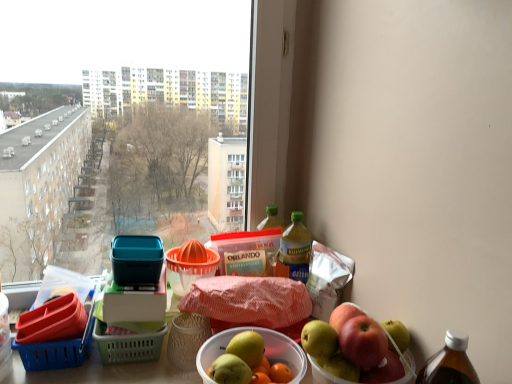
Measure the distance between orange plastic juicer at center, which is counted as the 2th basket, starting from the left, and camera.

The distance of orange plastic juicer at center, which is counted as the 2th basket, starting from the left, from camera is 3.28 feet.

Locate an element on the screen. The height and width of the screenshot is (384, 512). blue plastic basket at lower left, the 1th basket when ordered from left to right is located at coordinates (55, 352).

Which of these two, shiny red apple at right or yellow translucent bottle at upper right, arranged as the first bottle when viewed from the right, is wider?

With larger width is shiny red apple at right.

Which is further, (x=411, y=377) or (x=297, y=260)?

Positioned behind is point (x=297, y=260).

From the image's perspective, between shiny red apple at right and yellow translucent bottle at upper right, arranged as the first bottle when viewed from the right, which one is located above?

yellow translucent bottle at upper right, arranged as the first bottle when viewed from the right.

Can you tell me how much orange plastic juicer at center, the 1th basket viewed from the top, and translucent plastic bottle at upper right, marked as the first bottle in a left-to-right arrangement, differ in facing direction?

The facing directions of orange plastic juicer at center, the 1th basket viewed from the top, and translucent plastic bottle at upper right, marked as the first bottle in a left-to-right arrangement, are 0.00125 degrees apart.

From the image's perspective, who appears lower, orange plastic juicer at center, which is counted as the 2th basket, starting from the left, or translucent plastic bottle at upper right, which ranks as the second bottle in right-to-left order?

orange plastic juicer at center, which is counted as the 2th basket, starting from the left, is shown below in the image.

Is point (180, 288) more distant than point (265, 221)?

No, (180, 288) is in front of (265, 221).

Between orange plastic juicer at center, the 1th basket viewed from the top, and translucent plastic bottle at upper right, which ranks as the second bottle in right-to-left order, which one is positioned behind?

translucent plastic bottle at upper right, which ranks as the second bottle in right-to-left order, is further away from the camera.

Considering the sizes of objects shiny red apple at right and translucent plastic bottle at upper right, which ranks as the second bottle in right-to-left order, in the image provided, who is shorter, shiny red apple at right or translucent plastic bottle at upper right, which ranks as the second bottle in right-to-left order,?

translucent plastic bottle at upper right, which ranks as the second bottle in right-to-left order.

From a real-world perspective, is shiny red apple at right physically located above or below translucent plastic bottle at upper right, marked as the first bottle in a left-to-right arrangement?

Clearly, from a real-world perspective, shiny red apple at right is below translucent plastic bottle at upper right, marked as the first bottle in a left-to-right arrangement.

In terms of width, does shiny red apple at right look wider or thinner when compared to translucent plastic bottle at upper right, which ranks as the second bottle in right-to-left order?

Considering their sizes, shiny red apple at right looks broader than translucent plastic bottle at upper right, which ranks as the second bottle in right-to-left order.

Could you measure the distance between shiny red apple at right and translucent plastic bottle at upper right, which ranks as the second bottle in right-to-left order?

The distance of shiny red apple at right from translucent plastic bottle at upper right, which ranks as the second bottle in right-to-left order, is 17.24 inches.

Measure the distance from orange plastic juicer at center, which is the second basket from bottom to top, to blue plastic basket at lower left, the second basket from the right.

orange plastic juicer at center, which is the second basket from bottom to top, is 9.84 inches away from blue plastic basket at lower left, the second basket from the right.

Which is in front, orange plastic juicer at center, the 1th basket viewed from the top, or blue plastic basket at lower left, the second basket when ordered from top to bottom?

blue plastic basket at lower left, the second basket when ordered from top to bottom, is in front.

Which object is wider, orange plastic juicer at center, the 1th basket viewed from the top, or blue plastic basket at lower left, the second basket when ordered from top to bottom?

blue plastic basket at lower left, the second basket when ordered from top to bottom.

Is point (196, 269) positioned in front of point (36, 353)?

That is False.

Is point (84, 355) positioned in front of point (207, 264)?

Yes.

Is blue plastic basket at lower left, the second basket when ordered from top to bottom, oriented away from orange plastic juicer at center, which ranks as the first basket in right-to-left order?

No, blue plastic basket at lower left, the second basket when ordered from top to bottom, is not facing the opposite direction of orange plastic juicer at center, which ranks as the first basket in right-to-left order.

Based on the photo, would you say blue plastic basket at lower left, the 1th basket when ordered from left to right, is inside or outside orange plastic juicer at center, which is the second basket from bottom to top?

blue plastic basket at lower left, the 1th basket when ordered from left to right, is outside orange plastic juicer at center, which is the second basket from bottom to top.

Is shiny red apple at right facing towards blue plastic basket at lower left, the second basket from the right?

No, shiny red apple at right is not facing towards blue plastic basket at lower left, the second basket from the right.

Which object is further away from the camera taking this photo, shiny red apple at right or blue plastic basket at lower left, the second basket when ordered from top to bottom?

blue plastic basket at lower left, the second basket when ordered from top to bottom, is further away from the camera.

Does shiny red apple at right have a greater height compared to blue plastic basket at lower left, the second basket when ordered from top to bottom?

Yes, shiny red apple at right is taller than blue plastic basket at lower left, the second basket when ordered from top to bottom.

Is shiny red apple at right wider than blue plastic basket at lower left, the second basket from the right?

Incorrect, the width of shiny red apple at right does not surpass that of blue plastic basket at lower left, the second basket from the right.

Between translucent plastic bottle at upper right, which ranks as the second bottle in right-to-left order, and yellow translucent bottle at upper right, the 2th bottle from the left, which one has less height?

With less height is yellow translucent bottle at upper right, the 2th bottle from the left.

Considering the sizes of objects translucent plastic bottle at upper right, marked as the first bottle in a left-to-right arrangement, and yellow translucent bottle at upper right, the 2th bottle from the left, in the image provided, who is wider, translucent plastic bottle at upper right, marked as the first bottle in a left-to-right arrangement, or yellow translucent bottle at upper right, the 2th bottle from the left,?

Wider between the two is yellow translucent bottle at upper right, the 2th bottle from the left.

From the image's perspective, is translucent plastic bottle at upper right, marked as the first bottle in a left-to-right arrangement, located beneath yellow translucent bottle at upper right, arranged as the first bottle when viewed from the right?

No.

How far apart are translucent plastic bottle at upper right, marked as the first bottle in a left-to-right arrangement, and yellow translucent bottle at upper right, arranged as the first bottle when viewed from the right?

translucent plastic bottle at upper right, marked as the first bottle in a left-to-right arrangement, is 3.53 inches away from yellow translucent bottle at upper right, arranged as the first bottle when viewed from the right.

Where is `the 1st bottle behind the shiny red apple at right, starting your count from the anchor`? the 1st bottle behind the shiny red apple at right, starting your count from the anchor is located at coordinates (295, 250).

From a real-world perspective, which bottle is the 2nd one above the orange plastic juicer at center, the 1th basket viewed from the top? Please provide its 2D coordinates.

[(271, 219)]

Based on their spatial positions, is orange plastic juicer at center, the 1th basket viewed from the top, or translucent plastic bottle at upper right, which ranks as the second bottle in right-to-left order, closer to shiny red apple at right?

orange plastic juicer at center, the 1th basket viewed from the top, is closer to shiny red apple at right.

Which object lies nearer to the anchor point yellow translucent bottle at upper right, arranged as the first bottle when viewed from the right, orange plastic juicer at center, which ranks as the first basket in right-to-left order, or shiny red apple at right?

Among the two, orange plastic juicer at center, which ranks as the first basket in right-to-left order, is located nearer to yellow translucent bottle at upper right, arranged as the first bottle when viewed from the right.

From the image, which object appears to be nearer to translucent plastic bottle at upper right, which ranks as the second bottle in right-to-left order, yellow translucent bottle at upper right, the 2th bottle from the left, or blue plastic basket at lower left, the second basket from the right?

The object closer to translucent plastic bottle at upper right, which ranks as the second bottle in right-to-left order, is yellow translucent bottle at upper right, the 2th bottle from the left.

From the image, which object appears to be farther from shiny red apple at right, translucent plastic bottle at upper right, marked as the first bottle in a left-to-right arrangement, or orange plastic juicer at center, the 1th basket viewed from the top?

translucent plastic bottle at upper right, marked as the first bottle in a left-to-right arrangement, is further to shiny red apple at right.

Estimate the real-world distances between objects in this image. Which object is further from orange plastic juicer at center, the 1th basket viewed from the top, yellow translucent bottle at upper right, the 2th bottle from the left, or translucent plastic bottle at upper right, which ranks as the second bottle in right-to-left order?

The object further to orange plastic juicer at center, the 1th basket viewed from the top, is translucent plastic bottle at upper right, which ranks as the second bottle in right-to-left order.

Considering their positions, is blue plastic basket at lower left, the second basket from the right, positioned further to yellow translucent bottle at upper right, the 2th bottle from the left, than shiny red apple at right?

The object further to yellow translucent bottle at upper right, the 2th bottle from the left, is blue plastic basket at lower left, the second basket from the right.

Based on their spatial positions, is blue plastic basket at lower left, the second basket from the right, or translucent plastic bottle at upper right, marked as the first bottle in a left-to-right arrangement, closer to yellow translucent bottle at upper right, arranged as the first bottle when viewed from the right?

translucent plastic bottle at upper right, marked as the first bottle in a left-to-right arrangement, is positioned closer to the anchor yellow translucent bottle at upper right, arranged as the first bottle when viewed from the right.

Looking at the image, which one is located closer to translucent plastic bottle at upper right, marked as the first bottle in a left-to-right arrangement, orange plastic juicer at center, which is counted as the 2th basket, starting from the left, or shiny red apple at right?

Based on the image, orange plastic juicer at center, which is counted as the 2th basket, starting from the left, appears to be nearer to translucent plastic bottle at upper right, marked as the first bottle in a left-to-right arrangement.

Locate an element on the screen. The image size is (512, 384). basket located between blue plastic basket at lower left, the second basket from the right, and translucent plastic bottle at upper right, marked as the first bottle in a left-to-right arrangement, in the left-right direction is located at coordinates (188, 270).

You are a GUI agent. You are given a task and a screenshot of the screen. Output one action in this format:
    pyautogui.click(x=<x>, y=<y>)
    Task: Click on the bottle between shiny red apple at right and translucent plastic bottle at upper right, marked as the first bottle in a left-to-right arrangement, in the front-back direction
    
    Given the screenshot: What is the action you would take?
    [295, 250]

Find the location of a particular element. basket between blue plastic basket at lower left, the second basket from the right, and yellow translucent bottle at upper right, the 2th bottle from the left, from left to right is located at coordinates (188, 270).

The height and width of the screenshot is (384, 512). Identify the location of bottle located between orange plastic juicer at center, which is counted as the 2th basket, starting from the left, and yellow translucent bottle at upper right, arranged as the first bottle when viewed from the right, in the left-right direction. (271, 219).